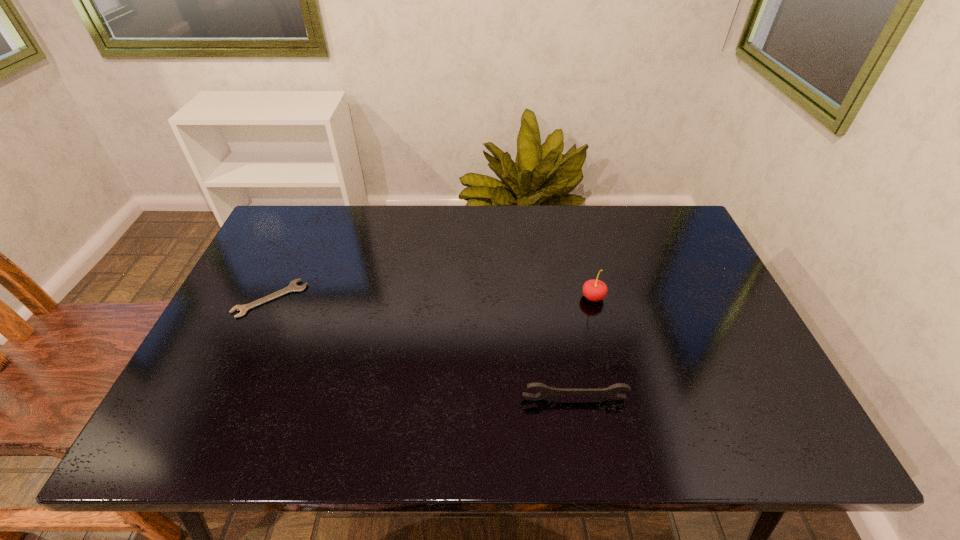
Identify the location of cherry. (594, 290).

Identify the location of the right wrench. (611, 392).

At what (x,y) coordinates should I click in order to perform the action: click on the nearer wrench. Please return your answer as a coordinate pair (x, y). The height and width of the screenshot is (540, 960). Looking at the image, I should click on click(x=611, y=392).

Where is `the shorter wrench`? the shorter wrench is located at coordinates (293, 287).

Find the location of `the shortest object`. the shortest object is located at coordinates (293, 287).

Image resolution: width=960 pixels, height=540 pixels. In order to click on free space located 0.330m on the right of the tallest object in this screenshot , I will do `click(724, 298)`.

Where is `free region located on the open ends of the nearest object`? The width and height of the screenshot is (960, 540). free region located on the open ends of the nearest object is located at coordinates (579, 426).

At what (x,y) coordinates should I click in order to perform the action: click on vacant area located 0.350m on the right of the shortest object. Please return your answer as a coordinate pair (x, y). This screenshot has height=540, width=960. Looking at the image, I should click on (429, 299).

Image resolution: width=960 pixels, height=540 pixels. I want to click on object that is at the left edge, so click(x=293, y=287).

This screenshot has width=960, height=540. In order to click on vacant space at the far edge of the desktop in this screenshot , I will do `click(626, 230)`.